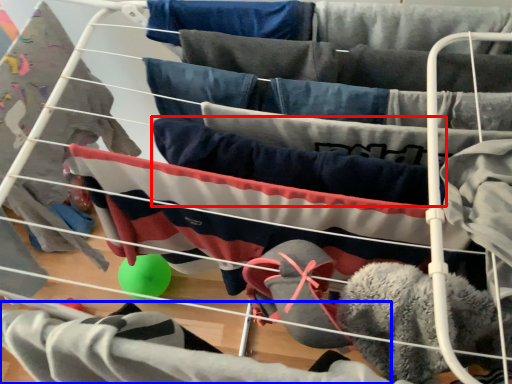
Question: Among these objects, which one is farthest to the camera, clothing (highlighted by a red box) or clothing (highlighted by a blue box)?

Choices:
 (A) clothing
 (B) clothing

Answer: (A)